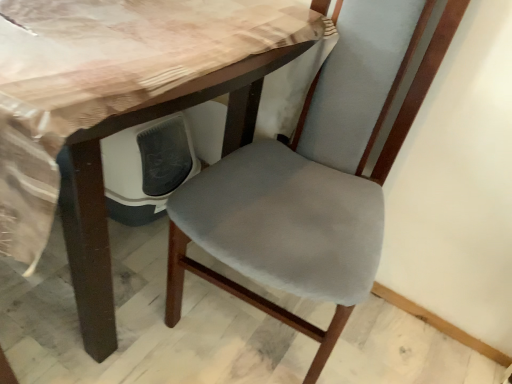
This screenshot has width=512, height=384. What are the coordinates of `wooden table at center` in the screenshot? It's located at (118, 108).

What do you see at coordinates (118, 108) in the screenshot?
I see `wooden table at center` at bounding box center [118, 108].

The height and width of the screenshot is (384, 512). Find the location of `wooden table at center`. wooden table at center is located at coordinates (118, 108).